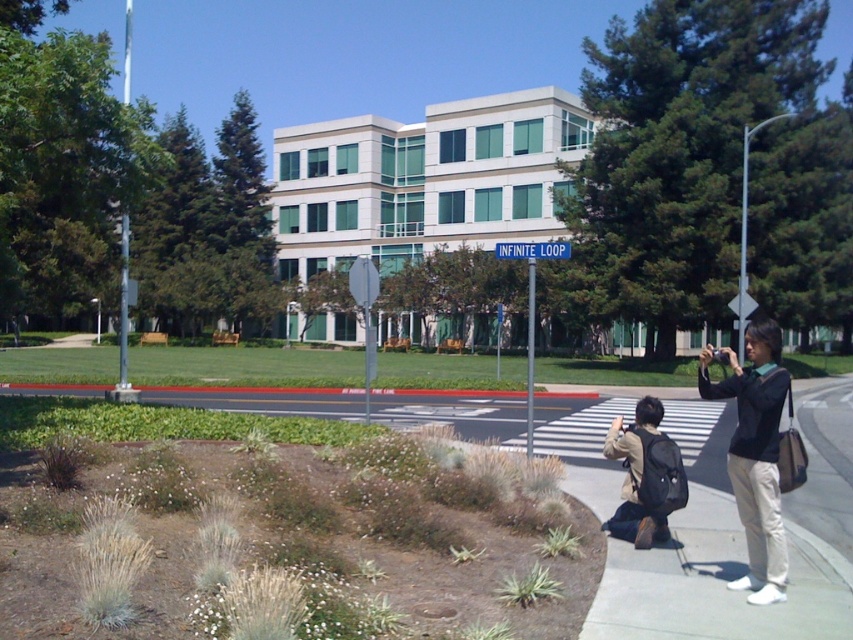
You are a security guard at the office complex and need to identify who is closer to the entrance. You see the dark blue shirt at right and the khaki cotton jacket at lower right. Which individual is positioned closer to the building entrance?

The dark blue shirt at right is positioned closer to the building entrance because it is in front of the khaki cotton jacket at lower right.

You are a security guard at the corporate complex and need to identify which person is taller. You observe the dark blue shirt at right and the khaki cotton jacket at lower right. Which individual is taller?

The dark blue shirt at right is taller than the khaki cotton jacket at lower right.